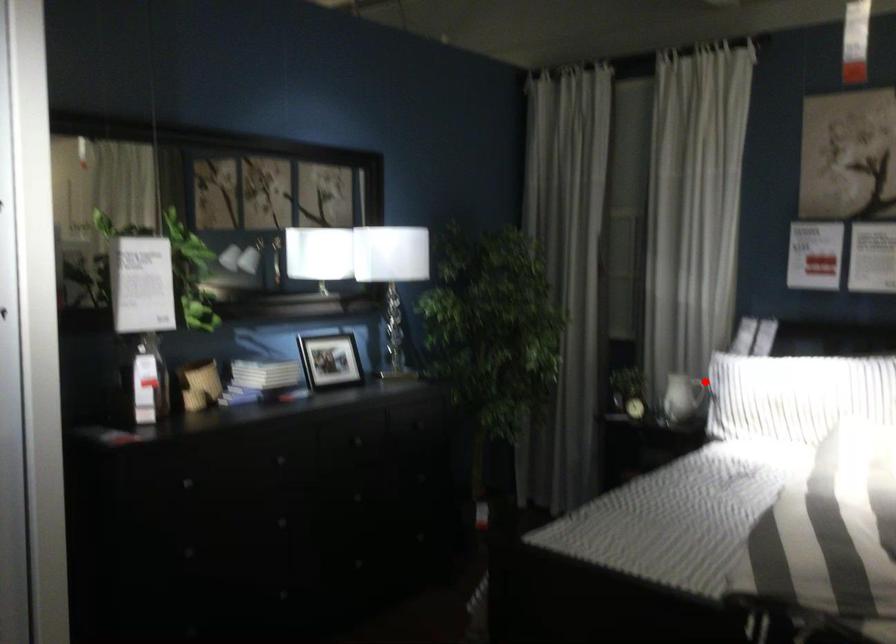
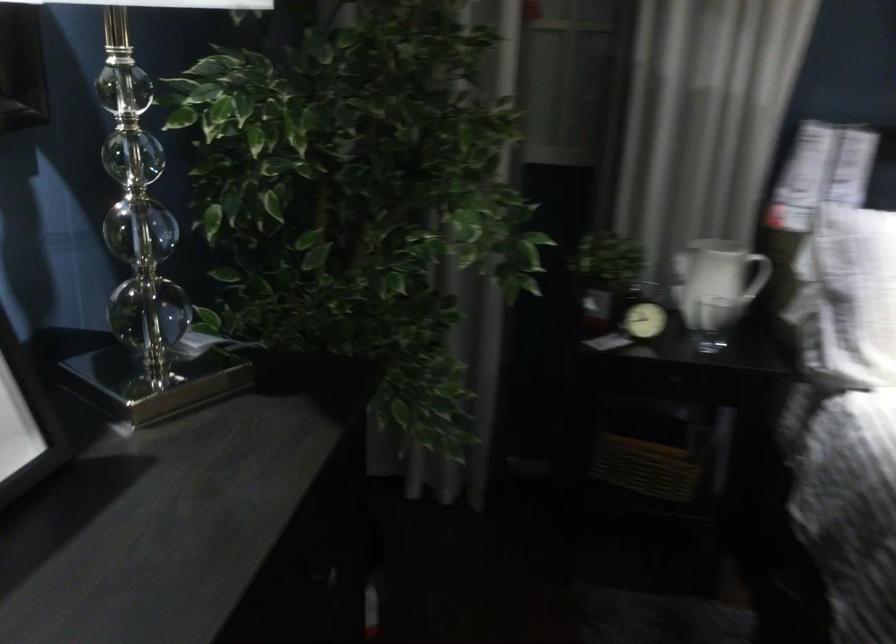
Locate, in the second image, the point that corresponds to the highlighted location in the first image.

(765, 276)